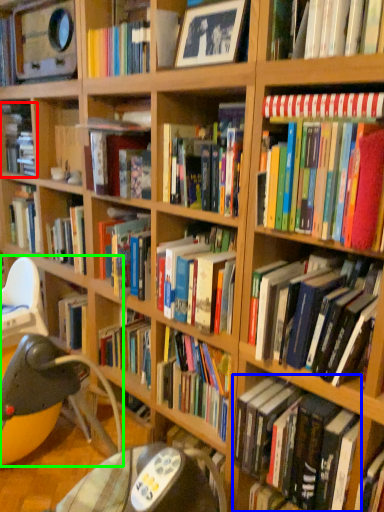
Question: Based on their relative distances, which object is farther from book (highlighted by a red box)? Choose from book (highlighted by a blue box) and bean bag chair (highlighted by a green box).

Choices:
 (A) book
 (B) bean bag chair

Answer: (A)